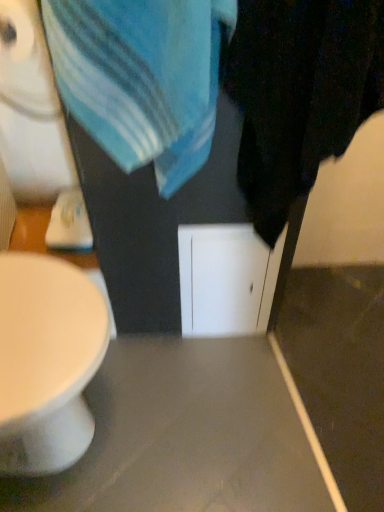
Locate an element on the screen. The image size is (384, 512). vacant space situated above matte gray table at center (from a real-world perspective) is located at coordinates [250, 385].